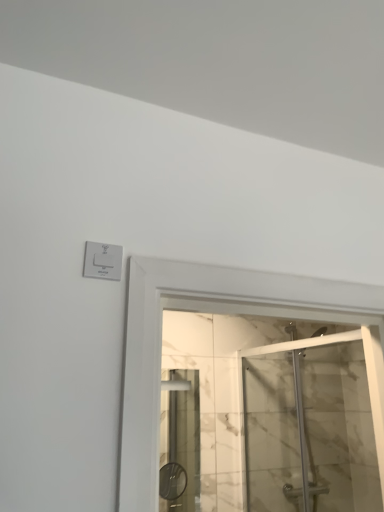
Question: Is white plastic switch at upper left situated inside transparent glass shower door at center or outside?

Choices:
 (A) outside
 (B) inside

Answer: (A)

Question: In terms of size, does white plastic switch at upper left appear bigger or smaller than transparent glass shower door at center?

Choices:
 (A) big
 (B) small

Answer: (B)

Question: From a real-world perspective, is white plastic switch at upper left physically located above or below transparent glass shower door at center?

Choices:
 (A) above
 (B) below

Answer: (A)

Question: From a real-world perspective, is transparent glass shower door at center positioned above or below white plastic switch at upper left?

Choices:
 (A) below
 (B) above

Answer: (A)

Question: Is transparent glass shower door at center in front of or behind white plastic switch at upper left in the image?

Choices:
 (A) front
 (B) behind

Answer: (B)

Question: Is transparent glass shower door at center taller or shorter than white plastic switch at upper left?

Choices:
 (A) tall
 (B) short

Answer: (A)

Question: Looking at their shapes, would you say transparent glass shower door at center is wider or thinner than white plastic switch at upper left?

Choices:
 (A) wide
 (B) thin

Answer: (A)